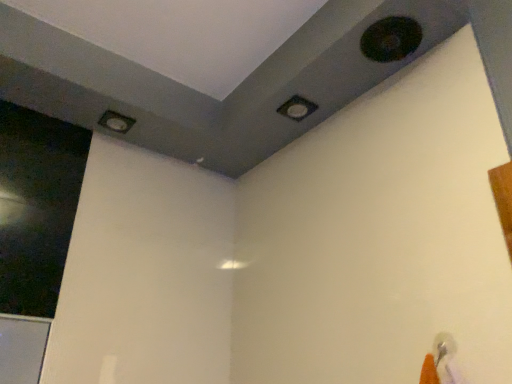
Find the location of `transparent glass screen door at left`. transparent glass screen door at left is located at coordinates (34, 230).

Find the location of a particular element. matte black square at upper center, which is the 2th hole in front-to-back order is located at coordinates (297, 108).

Describe the element at coordinates (297, 108) in the screenshot. I see `matte black square at upper center, which is the 2th hole from top to bottom` at that location.

The image size is (512, 384). Find the location of `transparent glass screen door at left`. transparent glass screen door at left is located at coordinates (34, 230).

Is transparent glass screen door at left not near matte black square at upper center, which is the 2th hole from top to bottom?

No, transparent glass screen door at left is in close proximity to matte black square at upper center, which is the 2th hole from top to bottom.

Is transparent glass screen door at left thinner than matte black square at upper center, which is the 2th hole in front-to-back order?

Yes.

In the scene shown: Does transparent glass screen door at left have a smaller size compared to matte black square at upper center, placed as the second hole when sorted from left to right?

No.

From a real-world perspective, is transparent glass screen door at left over matte black square at upper center, which is the 2th hole from top to bottom?

No.

Is transparent glass screen door at left at the right side of matte gray hole at upper left, the third hole in the top-to-bottom sequence?

No.

I want to click on the 2nd hole behind the transparent glass screen door at left, starting your count from the anchor, so click(x=116, y=122).

Is point (29, 156) closer or farther from the camera than point (128, 125)?

Clearly, point (29, 156) is closer to the camera than point (128, 125).

Does transparent glass screen door at left have a lesser height compared to matte gray hole at upper left, placed as the first hole when sorted from left to right?

No, transparent glass screen door at left is not shorter than matte gray hole at upper left, placed as the first hole when sorted from left to right.

Looking at their sizes, would you say black matte hole at upper right, marked as the first hole in a right-to-left arrangement, is wider or thinner than matte gray hole at upper left, the third hole viewed from the front?

Clearly, black matte hole at upper right, marked as the first hole in a right-to-left arrangement, has more width compared to matte gray hole at upper left, the third hole viewed from the front.

Does point (393, 19) appear closer or farther from the camera than point (104, 125)?

Point (393, 19) is positioned closer to the camera compared to point (104, 125).

From the image's perspective, between black matte hole at upper right, which is counted as the third hole, starting from the bottom, and matte gray hole at upper left, which appears as the first hole when viewed from the back, which one is located above?

black matte hole at upper right, which is counted as the third hole, starting from the bottom, is shown above in the image.

Does black matte hole at upper right, which is counted as the third hole, starting from the bottom, contain matte gray hole at upper left, acting as the first hole starting from the bottom?

No, matte gray hole at upper left, acting as the first hole starting from the bottom, is not a part of black matte hole at upper right, which is counted as the third hole, starting from the bottom.

Can you see matte black square at upper center, the second hole in the right-to-left sequence, touching transparent glass screen door at left?

No, matte black square at upper center, the second hole in the right-to-left sequence, is not next to transparent glass screen door at left.

You are a GUI agent. You are given a task and a screenshot of the screen. Output one action in this format:
    pyautogui.click(x=<x>, y=<y>)
    Task: Click on the screen door below the matte black square at upper center, positioned as the second hole in back-to-front order (from the image's perspective)
    The height and width of the screenshot is (384, 512).
    Given the screenshot: What is the action you would take?
    pyautogui.click(x=34, y=230)

Can transparent glass screen door at left be found inside matte black square at upper center, acting as the second hole starting from the bottom?

No, transparent glass screen door at left is not a part of matte black square at upper center, acting as the second hole starting from the bottom.

From the image's perspective, is matte black square at upper center, which is the 2th hole from top to bottom, beneath transparent glass screen door at left?

No, from the image's perspective, matte black square at upper center, which is the 2th hole from top to bottom, is not beneath transparent glass screen door at left.

Considering the sizes of matte gray hole at upper left, which is the third hole from right to left, and matte black square at upper center, placed as the second hole when sorted from left to right, in the image, is matte gray hole at upper left, which is the third hole from right to left, wider or thinner than matte black square at upper center, placed as the second hole when sorted from left to right,?

In the image, matte gray hole at upper left, which is the third hole from right to left, appears to be wider than matte black square at upper center, placed as the second hole when sorted from left to right.

Are matte gray hole at upper left, placed as the first hole when sorted from left to right, and matte black square at upper center, acting as the second hole starting from the bottom, far apart?

No, matte gray hole at upper left, placed as the first hole when sorted from left to right, is not far away from matte black square at upper center, acting as the second hole starting from the bottom.

Is matte gray hole at upper left, placed as the first hole when sorted from left to right, shorter than matte black square at upper center, which is the 2th hole in front-to-back order?

No.

Relative to matte black square at upper center, which is the 2th hole from top to bottom, is matte gray hole at upper left, the third hole in the top-to-bottom sequence, in front or behind?

Visually, matte gray hole at upper left, the third hole in the top-to-bottom sequence, is located behind matte black square at upper center, which is the 2th hole from top to bottom.

Can you confirm if matte gray hole at upper left, which appears as the first hole when viewed from the back, is wider than transparent glass screen door at left?

Correct, the width of matte gray hole at upper left, which appears as the first hole when viewed from the back, exceeds that of transparent glass screen door at left.

Is matte gray hole at upper left, placed as the first hole when sorted from left to right, shorter than transparent glass screen door at left?

Yes, matte gray hole at upper left, placed as the first hole when sorted from left to right, is shorter than transparent glass screen door at left.

Considering the positions of point (129, 127) and point (21, 235), is point (129, 127) closer or farther from the camera than point (21, 235)?

Point (129, 127) is farther from the camera than point (21, 235).

Is matte gray hole at upper left, which is the third hole from right to left, facing towards transparent glass screen door at left?

No, matte gray hole at upper left, which is the third hole from right to left, is not facing towards transparent glass screen door at left.

Is matte gray hole at upper left, the third hole viewed from the front, not near black matte hole at upper right, which is counted as the third hole, starting from the bottom?

Actually, matte gray hole at upper left, the third hole viewed from the front, and black matte hole at upper right, which is counted as the third hole, starting from the bottom, are a little close together.

Does matte gray hole at upper left, placed as the first hole when sorted from left to right, have a larger size compared to black matte hole at upper right, the 3th hole when ordered from left to right?

No, matte gray hole at upper left, placed as the first hole when sorted from left to right, is not bigger than black matte hole at upper right, the 3th hole when ordered from left to right.

From the image's perspective, who appears lower, matte gray hole at upper left, placed as the first hole when sorted from left to right, or black matte hole at upper right, the 3th hole when ordered from left to right?

matte gray hole at upper left, placed as the first hole when sorted from left to right, from the image's perspective.

Identify the location of screen door in front of the matte black square at upper center, acting as the second hole starting from the bottom. (34, 230).

From the image's perspective, count 1st holes upward from the transparent glass screen door at left and point to it. Please provide its 2D coordinates.

[(116, 122)]

Considering their positions, is matte black square at upper center, which is the 2th hole from top to bottom, positioned closer to transparent glass screen door at left than black matte hole at upper right, which is counted as the third hole, starting from the bottom?

Answer: The object closer to transparent glass screen door at left is matte black square at upper center, which is the 2th hole from top to bottom.

Considering their positions, is matte gray hole at upper left, which is the third hole from right to left, positioned closer to transparent glass screen door at left than matte black square at upper center, which is the 2th hole in front-to-back order?

matte gray hole at upper left, which is the third hole from right to left, is closer to transparent glass screen door at left.

Estimate the real-world distances between objects in this image. Which object is closer to black matte hole at upper right, which is counted as the third hole, starting from the bottom, transparent glass screen door at left or matte black square at upper center, placed as the second hole when sorted from left to right?

Based on the image, matte black square at upper center, placed as the second hole when sorted from left to right, appears to be nearer to black matte hole at upper right, which is counted as the third hole, starting from the bottom.

Which object lies further to the anchor point matte gray hole at upper left, placed as the first hole when sorted from left to right, matte black square at upper center, placed as the second hole when sorted from left to right, or transparent glass screen door at left?

matte black square at upper center, placed as the second hole when sorted from left to right, lies further to matte gray hole at upper left, placed as the first hole when sorted from left to right, than the other object.

Estimate the real-world distances between objects in this image. Which object is closer to black matte hole at upper right, marked as the first hole in a right-to-left arrangement, matte black square at upper center, placed as the second hole when sorted from left to right, or matte gray hole at upper left, the third hole in the top-to-bottom sequence?

matte black square at upper center, placed as the second hole when sorted from left to right.

Consider the image. Which object lies further to the anchor point matte gray hole at upper left, the third hole viewed from the front, matte black square at upper center, the second hole in the right-to-left sequence, or black matte hole at upper right, the 3th hole when ordered from left to right?

The object further to matte gray hole at upper left, the third hole viewed from the front, is black matte hole at upper right, the 3th hole when ordered from left to right.

From the picture: When comparing their distances from black matte hole at upper right, which is the first hole in top-to-bottom order, does matte gray hole at upper left, which appears as the first hole when viewed from the back, or transparent glass screen door at left seem further?

transparent glass screen door at left is positioned further to the anchor black matte hole at upper right, which is the first hole in top-to-bottom order.

Estimate the real-world distances between objects in this image. Which object is closer to matte black square at upper center, the second hole in the right-to-left sequence, transparent glass screen door at left or matte gray hole at upper left, acting as the first hole starting from the bottom?

matte gray hole at upper left, acting as the first hole starting from the bottom, lies closer to matte black square at upper center, the second hole in the right-to-left sequence, than the other object.

What are the coordinates of `hole located between transparent glass screen door at left and matte black square at upper center, positioned as the second hole in back-to-front order, in the left-right direction` in the screenshot? It's located at (116, 122).

At what (x,y) coordinates should I click in order to perform the action: click on hole between matte gray hole at upper left, placed as the first hole when sorted from left to right, and black matte hole at upper right, the 3th hole when ordered from left to right. Please return your answer as a coordinate pair (x, y). Looking at the image, I should click on (297, 108).